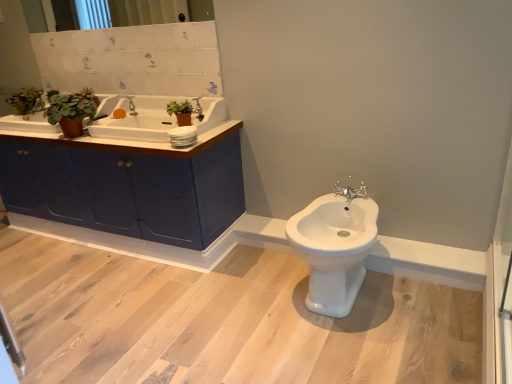
Question: Is white ceramic sink at upper left shorter than silver metallic tap at center, placed as the first tap when sorted from front to back?

Choices:
 (A) no
 (B) yes

Answer: (A)

Question: Would you say white ceramic sink at upper left contains silver metallic tap at center, the second tap from the back?

Choices:
 (A) yes
 (B) no

Answer: (B)

Question: From a real-world perspective, is white ceramic sink at upper left physically above silver metallic tap at center, the 2th tap in the left-to-right sequence?

Choices:
 (A) yes
 (B) no

Answer: (A)

Question: From a real-world perspective, is white ceramic sink at upper left beneath silver metallic tap at center, the second tap from the back?

Choices:
 (A) yes
 (B) no

Answer: (B)

Question: Is white ceramic sink at upper left further to the viewer compared to silver metallic tap at center, positioned as the first tap in right-to-left order?

Choices:
 (A) yes
 (B) no

Answer: (A)

Question: Is white ceramic sink at upper left bigger or smaller than white glossy bidet at center?

Choices:
 (A) small
 (B) big

Answer: (A)

Question: Considering the positions of white ceramic sink at upper left and white glossy bidet at center in the image, is white ceramic sink at upper left taller or shorter than white glossy bidet at center?

Choices:
 (A) tall
 (B) short

Answer: (B)

Question: Does point [x=220, y=115] appear closer or farther from the camera than point [x=353, y=246]?

Choices:
 (A) farther
 (B) closer

Answer: (A)

Question: Would you say white ceramic sink at upper left is inside or outside white glossy bidet at center?

Choices:
 (A) outside
 (B) inside

Answer: (A)

Question: Is point (113, 1) closer or farther from the camera than point (309, 226)?

Choices:
 (A) farther
 (B) closer

Answer: (A)

Question: Is clear glass mirror at upper center bigger or smaller than white glossy bidet at center?

Choices:
 (A) big
 (B) small

Answer: (B)

Question: From a real-world perspective, is clear glass mirror at upper center positioned above or below white glossy bidet at center?

Choices:
 (A) below
 (B) above

Answer: (B)

Question: Considering their positions, is clear glass mirror at upper center located in front of or behind white glossy bidet at center?

Choices:
 (A) behind
 (B) front

Answer: (A)

Question: Considering the positions of point (34, 3) and point (91, 137), is point (34, 3) closer or farther from the camera than point (91, 137)?

Choices:
 (A) farther
 (B) closer

Answer: (A)

Question: From a real-world perspective, is clear glass mirror at upper center physically located above or below matte blue cabinet at left?

Choices:
 (A) below
 (B) above

Answer: (B)